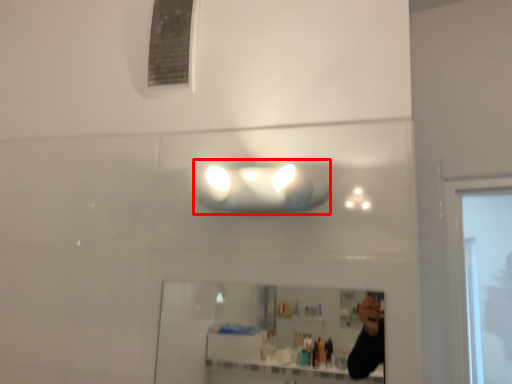
Question: From the image's perspective, what is the correct spatial relationship of light fixture (annotated by the red box) in relation to mirror?

Choices:
 (A) above
 (B) below

Answer: (A)